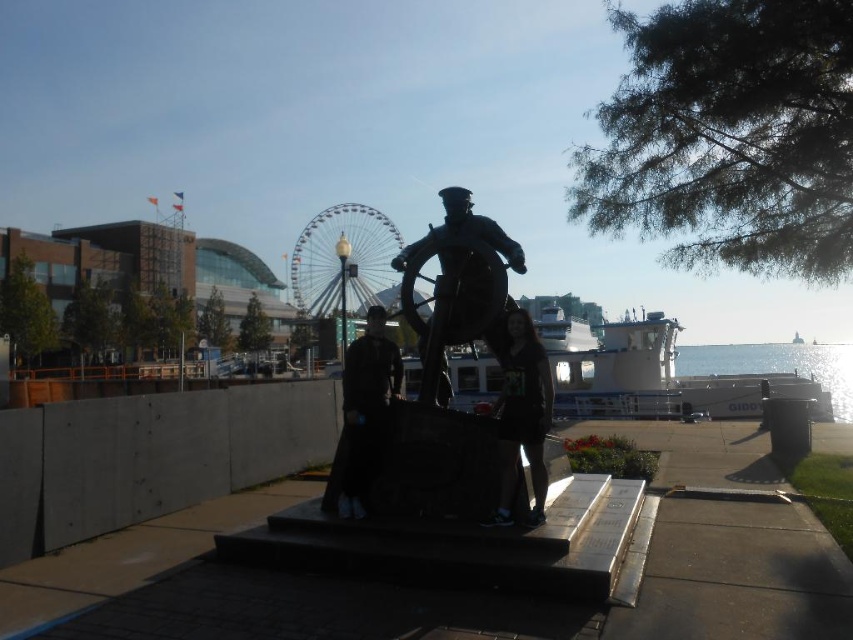
Question: Which point is closer to the camera taking this photo?

Choices:
 (A) (431, 248)
 (B) (665, 576)

Answer: (B)

Question: Observing the image, what is the correct spatial positioning of bronze statue at center in reference to dark gray fabric jacket at center?

Choices:
 (A) above
 (B) below

Answer: (A)

Question: Which object appears closest to the camera in this image?

Choices:
 (A) bronze statue at center
 (B) dark gray fabric jacket at center
 (C) dark gray fabric dress at center
 (D) shiny bronze statue at center

Answer: (C)

Question: Observing the image, what is the correct spatial positioning of shiny bronze statue at center in reference to dark gray fabric dress at center?

Choices:
 (A) right
 (B) left

Answer: (B)

Question: Estimate the real-world distances between objects in this image. Which object is farther from the dark gray fabric jacket at center?

Choices:
 (A) bronze statue at center
 (B) metallic ferris wheel at center
 (C) shiny bronze statue at center
 (D) shiny metallic ferris wheel at center

Answer: (B)

Question: Is metallic ferris wheel at center wider than dark gray fabric jacket at center?

Choices:
 (A) no
 (B) yes

Answer: (B)